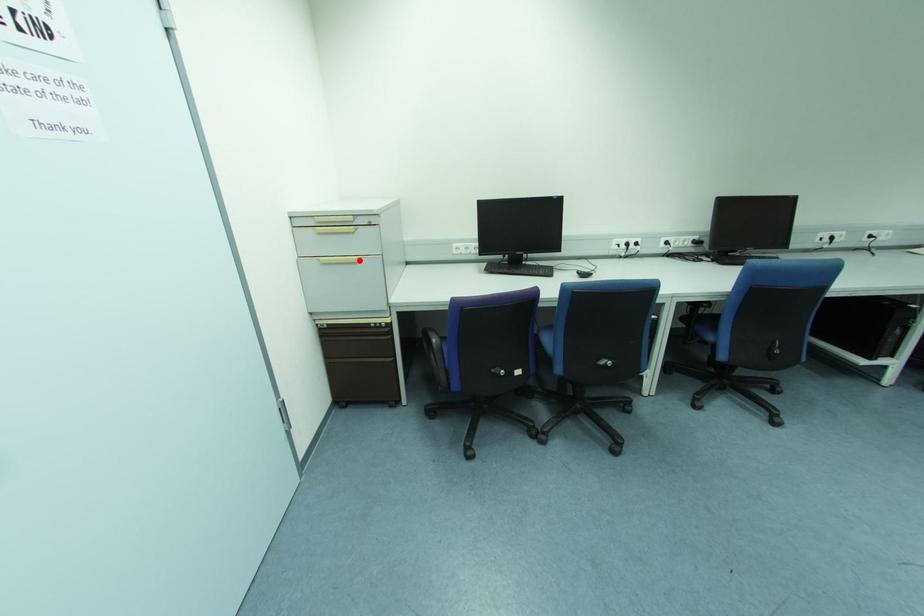
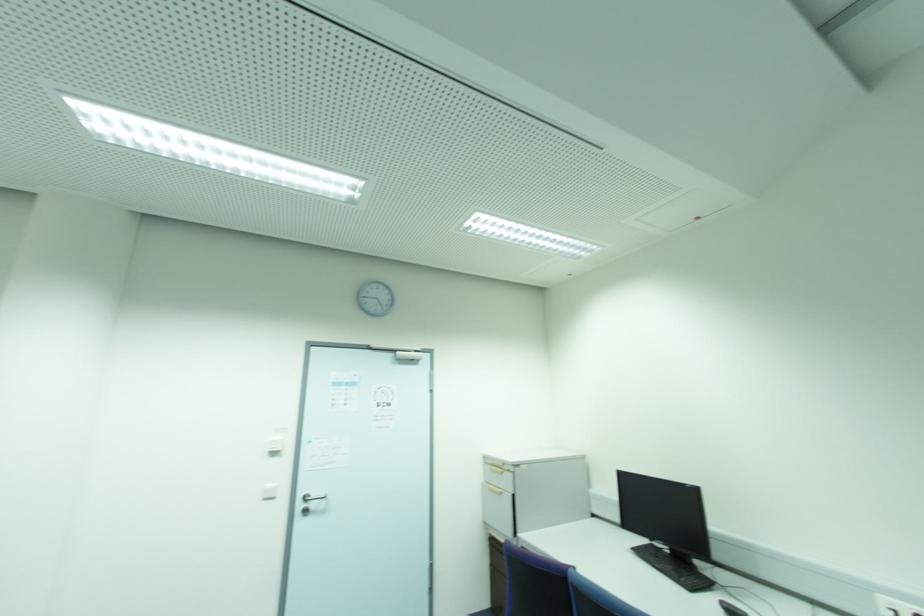
In the second image, find the point that corresponds to the highlighted location in the first image.

(502, 493)